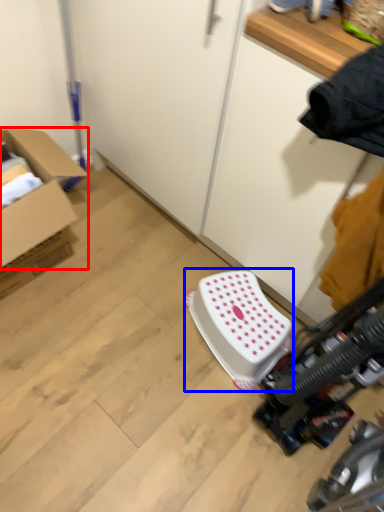
Question: Which object appears closest to the camera in this image, box (highlighted by a red box) or stool (highlighted by a blue box)?

Choices:
 (A) box
 (B) stool

Answer: (A)